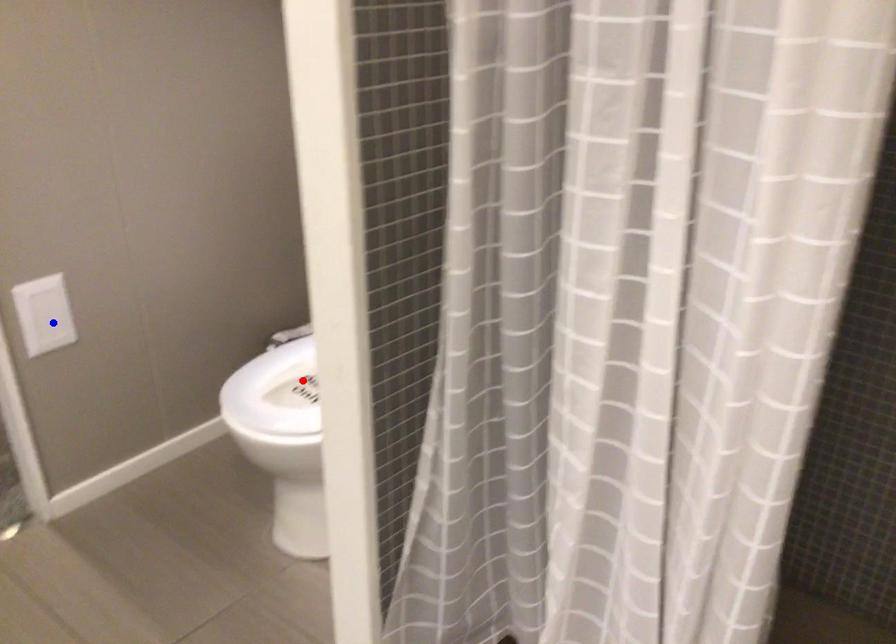
Question: Which of the two points in the image is closer to the camera?

Choices:
 (A) Blue point is closer.
 (B) Red point is closer.

Answer: (B)